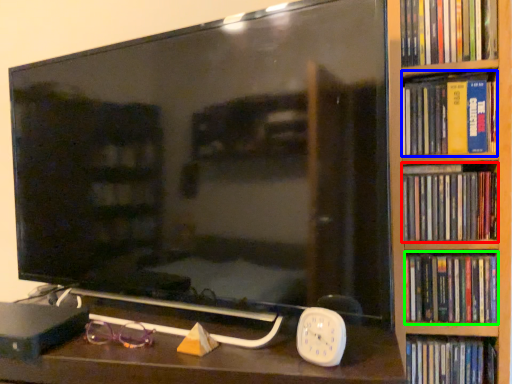
Question: Based on their relative distances, which object is farther from book (highlighted by a red box)? Choose from book (highlighted by a blue box) and book (highlighted by a green box).

Choices:
 (A) book
 (B) book

Answer: (A)